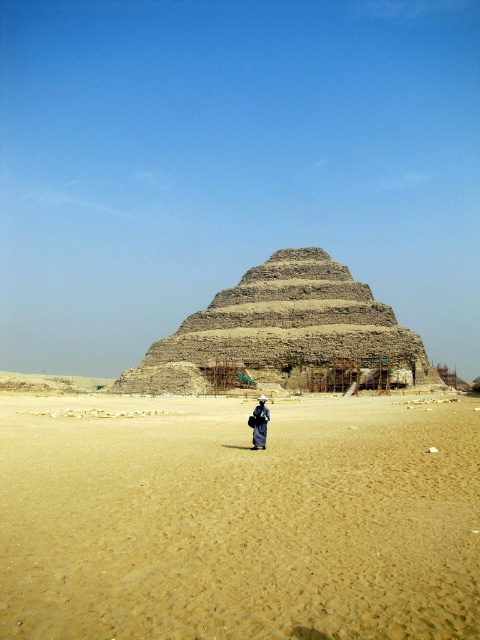
You are a tourist visiting the ancient pyramid. You have a dark blue fabric at center that you want to lay out on the light brown stone steps at center. Based on their widths, will the fabric fit entirely on the steps?

The light brown stone steps at center are wider than the dark blue fabric at center, so the fabric will fit entirely on the steps.

You are standing in front of the ancient stepped pyramid and see the brown sandy desert at center and the dark blue fabric at center. Which object is closer to you?

The brown sandy desert at center is closer to the viewer than the dark blue fabric at center.

You are standing at the origin point of the coordinate system in the desert scene. The coordinate system has its origin at the bottom left corner of the image, with the x and y axes increasing to the right and upwards respectively. You want to walk directly towards the light brown stone steps at center. What direction should you head in?

The light brown stone steps at center are located at coordinates point [286,336]. Since the origin is at the bottom left corner, moving towards the steps would require heading northeast, as the x and y coordinates are both greater than zero from the origin.